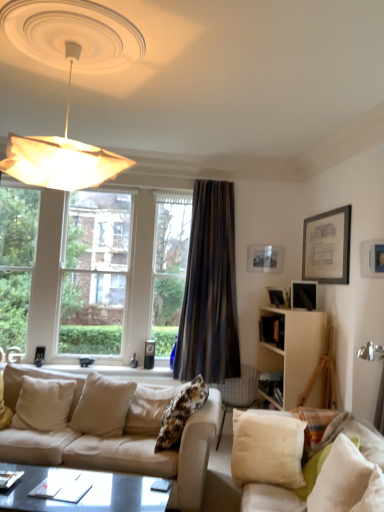
Question: From the image's perspective, is white cotton pillow at lower right, the fourth pillow when ordered from left to right, above or below matte black coffee table at lower center?

Choices:
 (A) below
 (B) above

Answer: (B)

Question: From a real-world perspective, relative to matte black coffee table at lower center, is white cotton pillow at lower right, which ranks as the 2th pillow in right-to-left order, vertically above or below?

Choices:
 (A) below
 (B) above

Answer: (B)

Question: Based on their relative distances, which object is farther from the white fabric couch at lower right, which appears as the 2th studio couch when viewed from the left?

Choices:
 (A) matte black picture frame at upper right, the third picture frame from the left
 (B) fluffy fabric pillow at center, the 3th pillow in the right-to-left sequence
 (C) white soft pillow at lower right, positioned as the 1th pillow in right-to-left order
 (D) matte black picture frame at upper right, acting as the 3th picture frame starting from the right
 (E) white wood cabinet at right

Answer: (D)

Question: Which object is the closest to the matte black picture frame at upper right, the third picture frame from the left?

Choices:
 (A) fluffy fabric pillow at center, placed as the 3th pillow when sorted from left to right
 (B) white soft pillow at lower right, positioned as the 1th pillow in right-to-left order
 (C) woven fabric chair at center
 (D) matte black picture frame at upper right, arranged as the first picture frame when viewed from the right
 (E) matte black picture frame at upper right, arranged as the 2th picture frame when viewed from the back

Answer: (E)